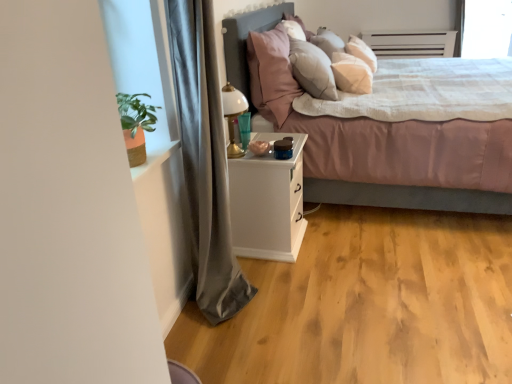
At what (x,y) coordinates should I click in order to perform the action: click on vacant space in front of white matte nightstand at center. Please return your answer as a coordinate pair (x, y). The width and height of the screenshot is (512, 384). Looking at the image, I should click on (293, 278).